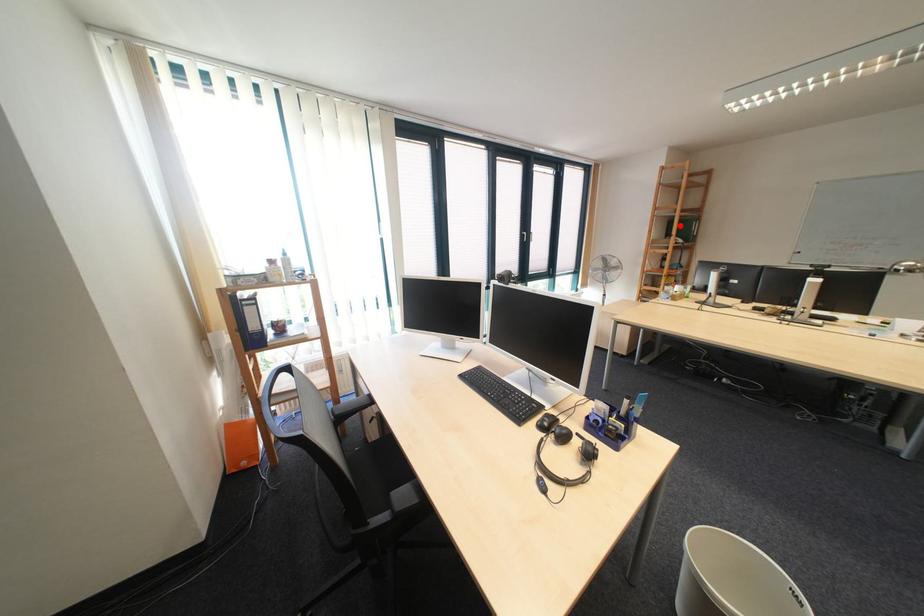
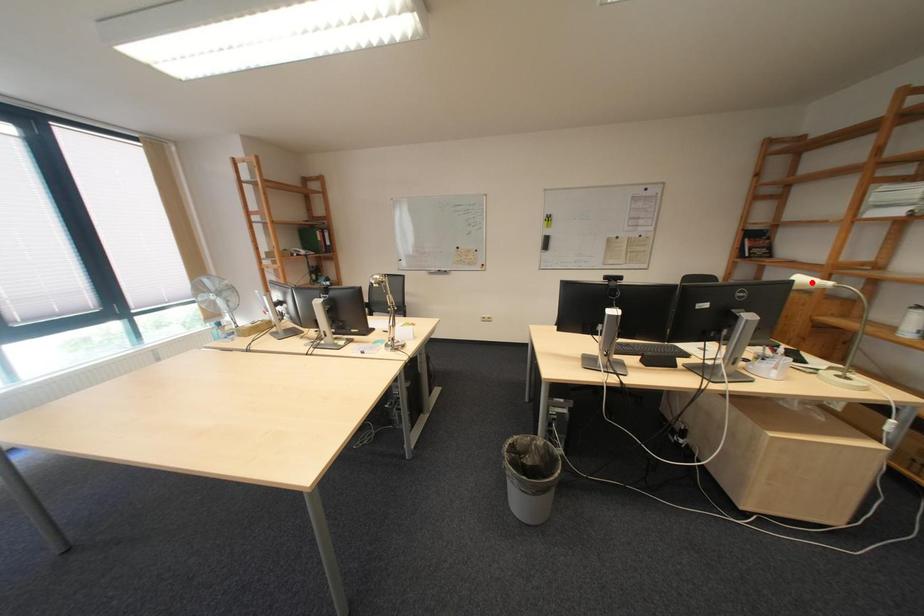
I am providing you with two images of the same scene from different viewpoints. A red point is marked on the first image and another point is marked on the second image. Do the highlighted points in image1 and image2 indicate the same real-world spot?

No